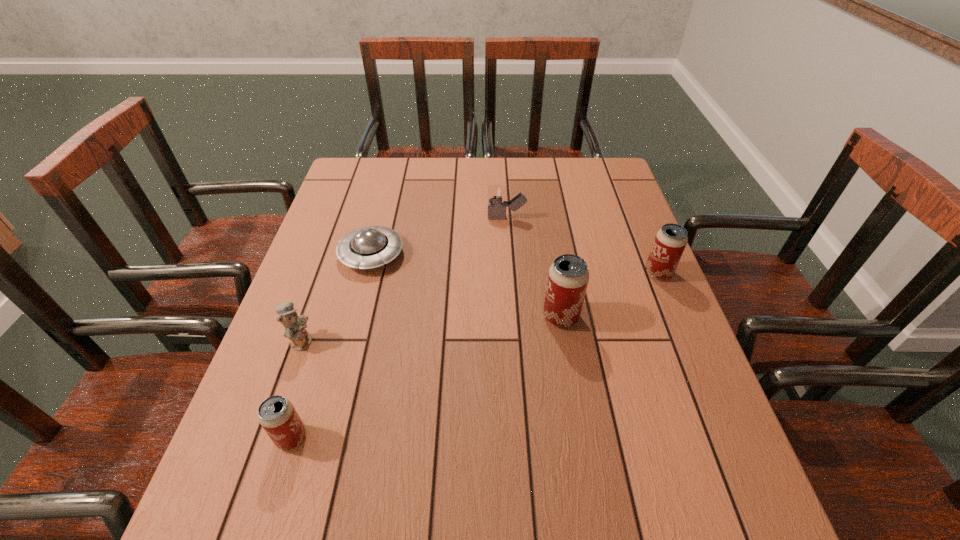
This screenshot has width=960, height=540. Find the location of `unoccupied area between the second nearest beer can and the third object from right to left`. unoccupied area between the second nearest beer can and the third object from right to left is located at coordinates (534, 267).

I want to click on free space that is in between the teddy bear and the fifth object from left to right, so click(431, 328).

I want to click on unoccupied area between the igniter and the shortest object, so click(x=439, y=236).

This screenshot has width=960, height=540. I want to click on free space that is in between the shortest object and the nearest beer can, so click(331, 346).

This screenshot has height=540, width=960. In order to click on vacant point located between the tallest beer can and the farthest beer can in this screenshot , I will do `click(610, 294)`.

Image resolution: width=960 pixels, height=540 pixels. In order to click on blank region between the second beer can from right to left and the saucer in this screenshot , I will do `click(467, 286)`.

The width and height of the screenshot is (960, 540). What are the coordinates of `vacant region between the second beer can from right to left and the rightmost object` in the screenshot? It's located at (610, 294).

Locate an element on the screen. This screenshot has width=960, height=540. unoccupied area between the second farthest beer can and the teddy bear is located at coordinates (431, 328).

Where is `object that is the second closest to the teddy bear`? The image size is (960, 540). object that is the second closest to the teddy bear is located at coordinates (368, 247).

Identify which object is located as the second nearest to the third object from right to left. Please provide its 2D coordinates. Your answer should be formatted as a tuple, i.e. [(x, y)], where the tuple contains the x and y coordinates of a point satisfying the conditions above.

[(568, 276)]